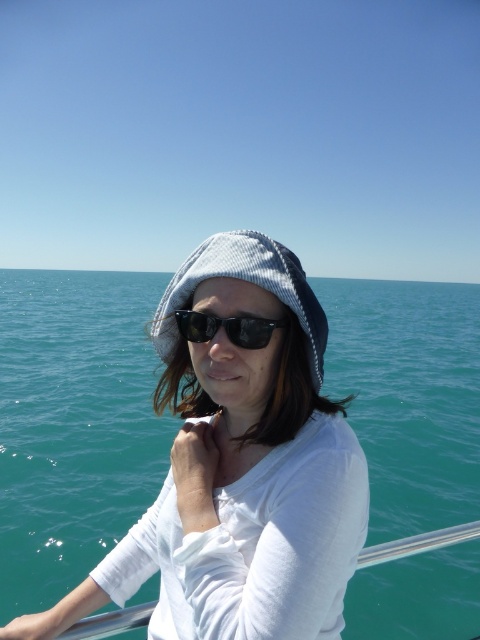
Question: Based on their relative distances, which object is farther from the black reflective sunglasses at center?

Choices:
 (A) woven fabric beanie at center
 (B) teal water at center

Answer: (B)

Question: In this image, where is woven fabric beanie at center located relative to black reflective sunglasses at center?

Choices:
 (A) right
 (B) left

Answer: (A)

Question: Does teal water at center appear under woven fabric beanie at center?

Choices:
 (A) yes
 (B) no

Answer: (B)

Question: Which object appears closest to the camera in this image?

Choices:
 (A) black reflective sunglasses at center
 (B) teal water at center
 (C) woven fabric beanie at center

Answer: (A)

Question: Which object is farther from the camera taking this photo?

Choices:
 (A) teal water at center
 (B) black reflective sunglasses at center
 (C) woven fabric beanie at center

Answer: (A)

Question: From the image, what is the correct spatial relationship of woven fabric beanie at center in relation to black reflective sunglasses at center?

Choices:
 (A) left
 (B) right

Answer: (B)